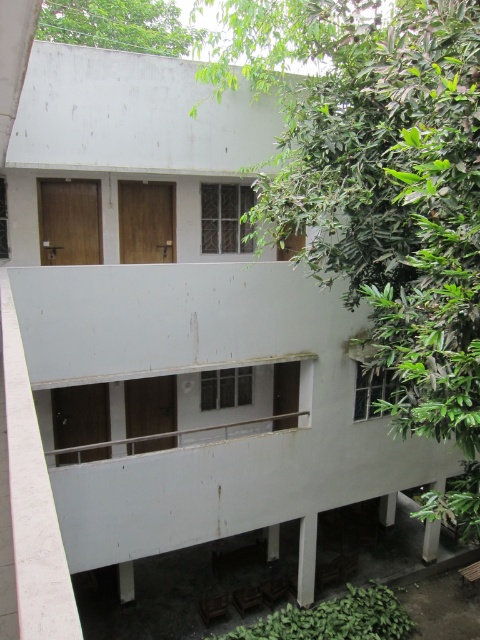
Question: Is green leafy tree at upper right above green leafy tree at upper left?

Choices:
 (A) no
 (B) yes

Answer: (A)

Question: Is green leafy tree at upper right positioned at the back of green leafy tree at upper left?

Choices:
 (A) no
 (B) yes

Answer: (A)

Question: Which object appears farthest from the camera in this image?

Choices:
 (A) green leafy tree at upper right
 (B) green leafy tree at upper left

Answer: (B)

Question: In this image, where is green leafy tree at upper right located relative to green leafy tree at upper left?

Choices:
 (A) above
 (B) below

Answer: (B)

Question: Which point is closer to the camera?

Choices:
 (A) (181, 26)
 (B) (359, 61)

Answer: (B)